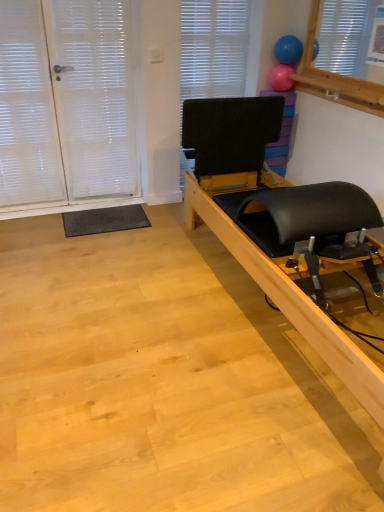
Question: From a real-world perspective, is black leather pilates reformer at right beneath blue rubber balloon at upper right, the 2th balloon in the bottom-to-top sequence?

Choices:
 (A) no
 (B) yes

Answer: (B)

Question: Is black leather pilates reformer at right positioned beyond the bounds of blue rubber balloon at upper right, the 2th balloon in the bottom-to-top sequence?

Choices:
 (A) yes
 (B) no

Answer: (A)

Question: From the image's perspective, is black leather pilates reformer at right over blue rubber balloon at upper right, which is the first balloon from top to bottom?

Choices:
 (A) no
 (B) yes

Answer: (A)

Question: From a real-world perspective, does black leather pilates reformer at right stand above blue rubber balloon at upper right, which is the first balloon from top to bottom?

Choices:
 (A) yes
 (B) no

Answer: (B)

Question: Considering the relative sizes of black leather pilates reformer at right and blue rubber balloon at upper right, the 2th balloon in the bottom-to-top sequence, in the image provided, is black leather pilates reformer at right wider than blue rubber balloon at upper right, the 2th balloon in the bottom-to-top sequence,?

Choices:
 (A) no
 (B) yes

Answer: (B)

Question: From the image's perspective, relative to blue rubber balloon at upper right, which is the first balloon from top to bottom, is pink rubber balloon at upper center, positioned as the second balloon in top-to-bottom order, above or below?

Choices:
 (A) below
 (B) above

Answer: (A)

Question: From a real-world perspective, is pink rubber balloon at upper center, acting as the 1th balloon starting from the bottom, above or below blue rubber balloon at upper right, the 2th balloon in the bottom-to-top sequence?

Choices:
 (A) below
 (B) above

Answer: (A)

Question: Visually, is pink rubber balloon at upper center, positioned as the second balloon in top-to-bottom order, positioned to the left or to the right of blue rubber balloon at upper right, which is the first balloon from top to bottom?

Choices:
 (A) left
 (B) right

Answer: (A)

Question: Do you think pink rubber balloon at upper center, positioned as the second balloon in top-to-bottom order, is within blue rubber balloon at upper right, which is the first balloon from top to bottom, or outside of it?

Choices:
 (A) inside
 (B) outside

Answer: (B)

Question: Is point (289, 68) positioned closer to the camera than point (190, 44)?

Choices:
 (A) farther
 (B) closer

Answer: (B)

Question: Relative to black matte blind at upper center, is pink rubber balloon at upper center, positioned as the second balloon in top-to-bottom order, in front or behind?

Choices:
 (A) behind
 (B) front

Answer: (A)

Question: Visually, is pink rubber balloon at upper center, positioned as the second balloon in top-to-bottom order, positioned to the left or to the right of black matte blind at upper center?

Choices:
 (A) left
 (B) right

Answer: (B)

Question: Considering the positions of pink rubber balloon at upper center, acting as the 1th balloon starting from the bottom, and black matte blind at upper center in the image, is pink rubber balloon at upper center, acting as the 1th balloon starting from the bottom, bigger or smaller than black matte blind at upper center?

Choices:
 (A) big
 (B) small

Answer: (B)

Question: Considering the positions of blue rubber balloon at upper right, which is the first balloon from top to bottom, and black matte blind at upper center in the image, is blue rubber balloon at upper right, which is the first balloon from top to bottom, taller or shorter than black matte blind at upper center?

Choices:
 (A) short
 (B) tall

Answer: (A)

Question: Is point (292, 44) closer or farther from the camera than point (236, 23)?

Choices:
 (A) farther
 (B) closer

Answer: (B)